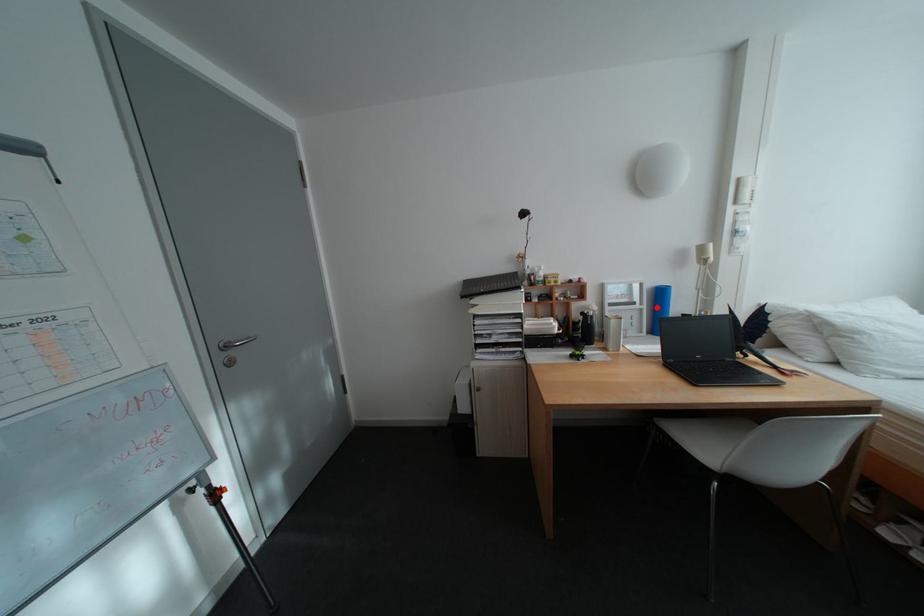
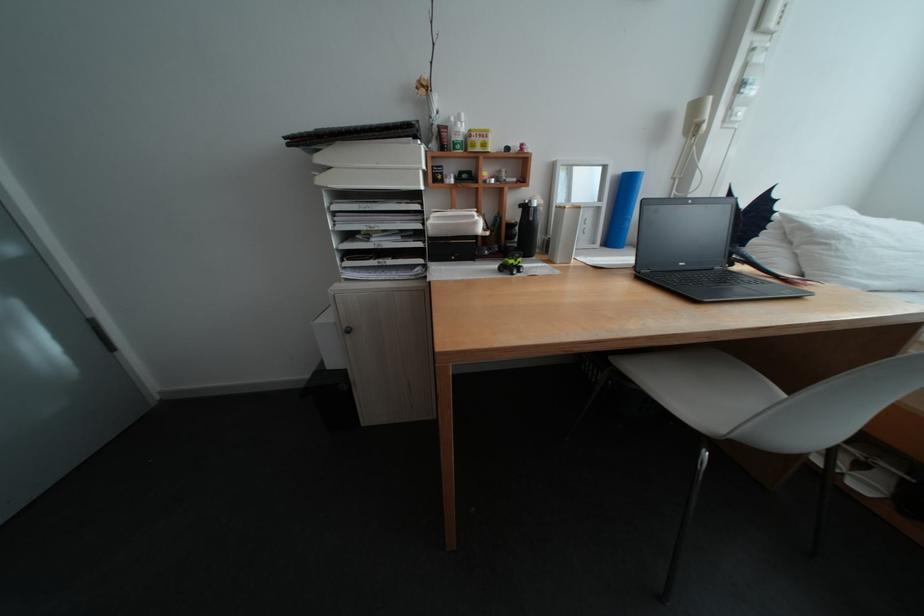
Find the pixel in the second image that matches the highlighted location in the first image.

(616, 205)